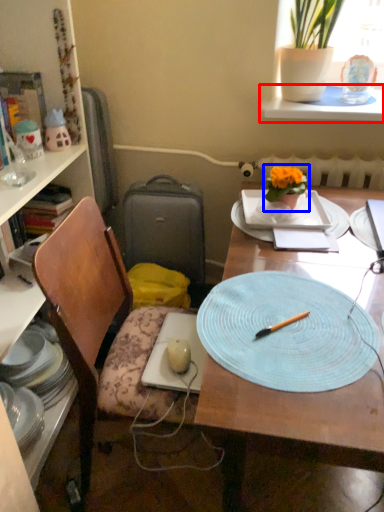
Question: Which point is closer to the camera, window sill (highlighted by a red box) or houseplant (highlighted by a blue box)?

Choices:
 (A) window sill
 (B) houseplant

Answer: (B)